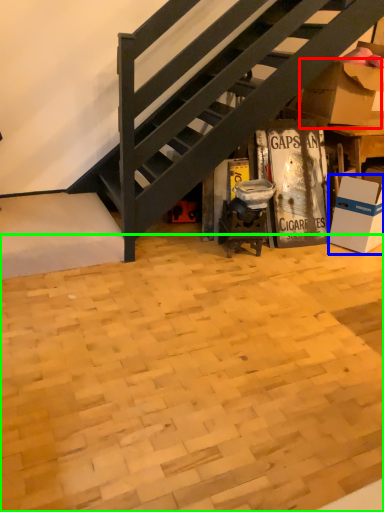
Question: Which object is positioned farthest from cardboard box (highlighted by a red box)? Select from box (highlighted by a blue box) and plywood (highlighted by a green box).

Choices:
 (A) box
 (B) plywood

Answer: (B)